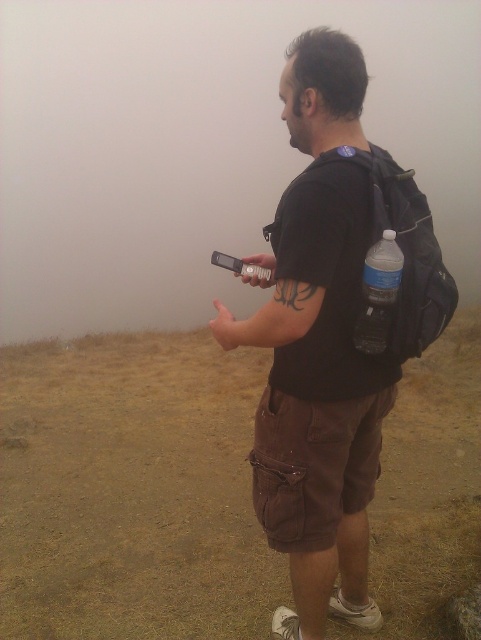
From the picture: Does clear plastic water bottle at back have a smaller size compared to brushed metal camera at upper center?

Yes.

Does clear plastic water bottle at back appear on the left side of brushed metal camera at upper center?

In fact, clear plastic water bottle at back is to the right of brushed metal camera at upper center.

Identify the location of clear plastic water bottle at back. click(379, 294).

Is the position of black fabric backpack at upper right more distant than that of brushed metal camera at upper center?

No, black fabric backpack at upper right is closer to the viewer.

Who is more distant from viewer, [442,300] or [241,280]?

The point [241,280] is behind.

What do you see at coordinates (397, 257) in the screenshot?
I see `black fabric backpack at upper right` at bounding box center [397, 257].

I want to click on black fabric backpack at upper right, so click(x=397, y=257).

Can you confirm if black matte shirt at center is positioned to the left of black fabric backpack at upper right?

Indeed, black matte shirt at center is positioned on the left side of black fabric backpack at upper right.

Who is lower down, black matte shirt at center or black fabric backpack at upper right?

Positioned lower is black matte shirt at center.

Between point (362, 611) and point (369, 150), which one is positioned in front?

Point (369, 150) is more forward.

Image resolution: width=481 pixels, height=640 pixels. Identify the location of black matte shirt at center. (318, 349).